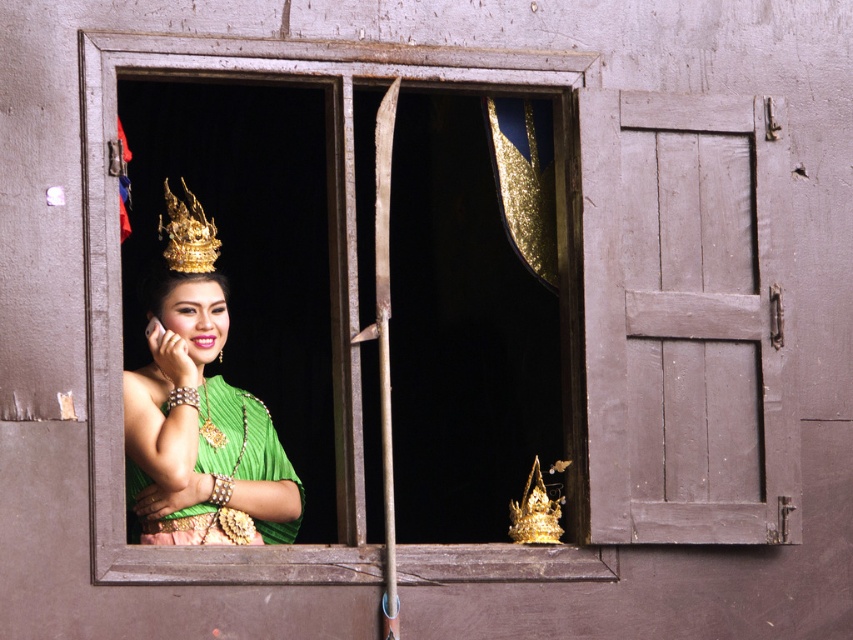
Does point (527, 572) lie behind point (149, 404)?

No, (527, 572) is closer to viewer.

Who is positioned more to the right, wooden window frame at center or green silk dress at center?

Positioned to the right is wooden window frame at center.

Locate an element on the screen. wooden window frame at center is located at coordinates (329, 266).

Find the location of a particular element. Image resolution: width=853 pixels, height=640 pixels. wooden shutter at right is located at coordinates tap(688, 317).

Who is more forward, (689, 195) or (207, 243)?

Point (689, 195) is in front.

Based on the photo, is wooden shutter at right further to camera compared to gold metallic crown at upper left?

No, wooden shutter at right is in front of gold metallic crown at upper left.

Does point (646, 481) lie behind point (206, 252)?

No.

The height and width of the screenshot is (640, 853). In order to click on wooden shutter at right in this screenshot , I will do `click(688, 317)`.